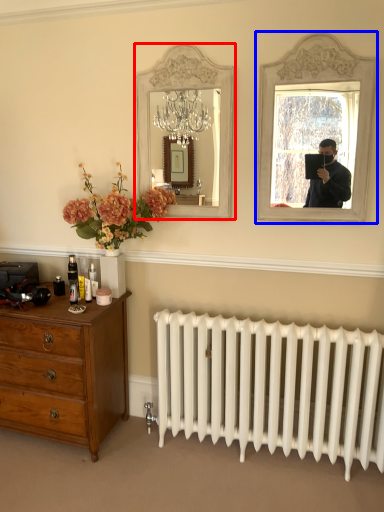
Question: Which point is further to the camera, mirror (highlighted by a red box) or picture frame (highlighted by a blue box)?

Choices:
 (A) mirror
 (B) picture frame

Answer: (A)